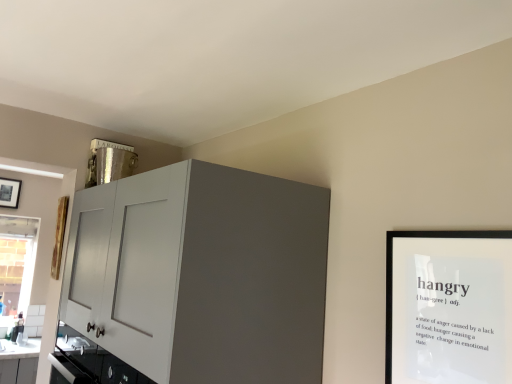
Question: Is matte white cabinet at upper left touching black matte picture frame at upper right?

Choices:
 (A) no
 (B) yes

Answer: (A)

Question: Is matte white cabinet at upper left taller than black matte picture frame at upper right?

Choices:
 (A) yes
 (B) no

Answer: (A)

Question: From the image's perspective, is matte white cabinet at upper left on top of black matte picture frame at upper right?

Choices:
 (A) no
 (B) yes

Answer: (A)

Question: Does matte white cabinet at upper left appear on the right side of black matte picture frame at upper right?

Choices:
 (A) no
 (B) yes

Answer: (A)

Question: Does matte white cabinet at upper left appear on the left side of black matte picture frame at upper right?

Choices:
 (A) no
 (B) yes

Answer: (B)

Question: Visually, is matte white cabinet at upper left positioned to the left or to the right of clear glass window at lower left?

Choices:
 (A) left
 (B) right

Answer: (B)

Question: Would you say matte white cabinet at upper left is inside or outside clear glass window at lower left?

Choices:
 (A) outside
 (B) inside

Answer: (A)

Question: From a real-world perspective, is matte white cabinet at upper left above or below clear glass window at lower left?

Choices:
 (A) below
 (B) above

Answer: (B)

Question: Looking at the image, does matte white cabinet at upper left seem bigger or smaller compared to clear glass window at lower left?

Choices:
 (A) big
 (B) small

Answer: (A)

Question: Considering the positions of point (233, 291) and point (477, 274), is point (233, 291) closer or farther from the camera than point (477, 274)?

Choices:
 (A) closer
 (B) farther

Answer: (B)

Question: From a real-world perspective, is matte white cabinet at upper left positioned above or below black matte picture frame at upper right?

Choices:
 (A) above
 (B) below

Answer: (B)

Question: Based on their positions, is matte white cabinet at upper left located to the left or right of black matte picture frame at upper right?

Choices:
 (A) left
 (B) right

Answer: (A)

Question: In the image, is matte white cabinet at upper left positioned in front of or behind black matte picture frame at upper right?

Choices:
 (A) behind
 (B) front

Answer: (A)

Question: From a real-world perspective, is black matte picture frame at upper right above or below matte white cabinet at upper left?

Choices:
 (A) below
 (B) above

Answer: (B)

Question: Is black matte picture frame at upper right in front of or behind matte white cabinet at upper left in the image?

Choices:
 (A) front
 (B) behind

Answer: (A)